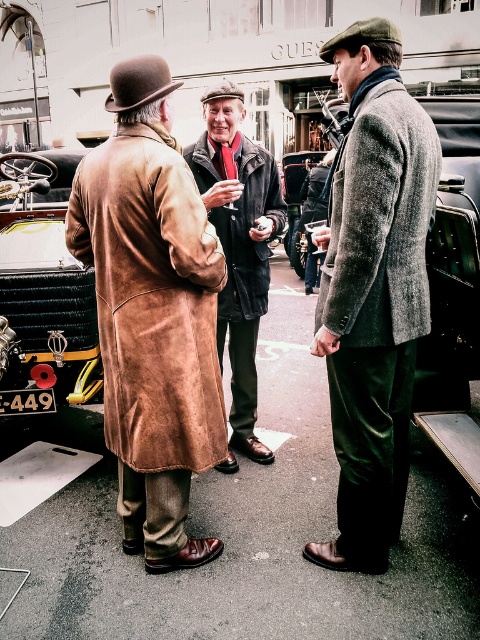
You are a photographer at a vintage car event. You need to position yourself to capture both the brown suede trench coat at left and the velvet black coat at center in the same frame. Based on their positions, which coat should be closer to the left side of your camera frame?

The brown suede trench coat at left is positioned to the left of the velvet black coat at center, so it should be closer to the left side of the camera frame.

You are a photographer at the vintage car event. You want to take a photo of the black leather car at left and the velvet black coat at center. Which object is positioned to the left of the other?

The black leather car at left is to the left of the velvet black coat at center.

You are a tailor observing the two coats in the image. The gray wool coat at center and the textured gray coat at center are both in need of alterations. If your measuring tape shows that the distance between them is 3.96 inches, can you comfortably reach both coats to measure them without moving your position?

The gray wool coat at center and textured gray coat at center are 3.96 inches apart, so yes, you can comfortably reach both coats to measure them without moving your position since the distance is within a typical comfortable reach range for most people.